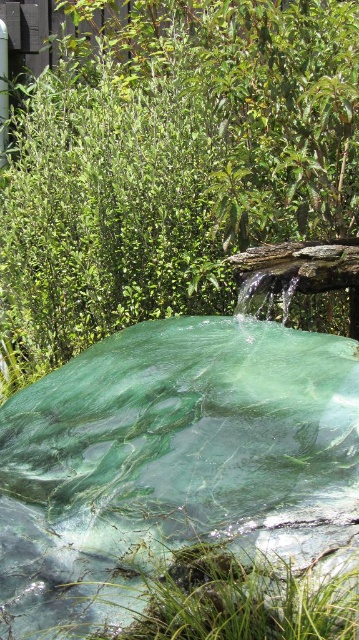
Question: Is green marble water at center closer to the viewer compared to green leafy grass at lower center?

Choices:
 (A) no
 (B) yes

Answer: (A)

Question: Which point is farther from the camera taking this photo?

Choices:
 (A) (269, 627)
 (B) (216, 40)
 (C) (226, 401)

Answer: (B)

Question: Does green leafy bush at upper center appear on the right side of green marble water at center?

Choices:
 (A) yes
 (B) no

Answer: (B)

Question: Which object appears closest to the camera in this image?

Choices:
 (A) green leafy grass at lower center
 (B) green leafy bush at upper center
 (C) green marble water at center

Answer: (A)

Question: Does green marble water at center appear on the left side of green leafy grass at lower center?

Choices:
 (A) no
 (B) yes

Answer: (B)

Question: Considering the real-world distances, which object is farthest from the green marble water at center?

Choices:
 (A) green leafy bush at upper center
 (B) green leafy grass at lower center

Answer: (A)